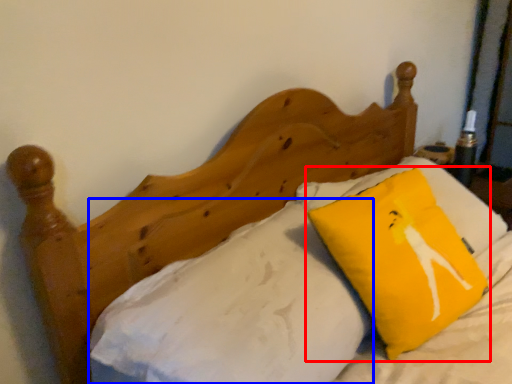
Question: Which object appears farthest to the camera in this image, pillow (highlighted by a red box) or sheet (highlighted by a blue box)?

Choices:
 (A) pillow
 (B) sheet

Answer: (A)